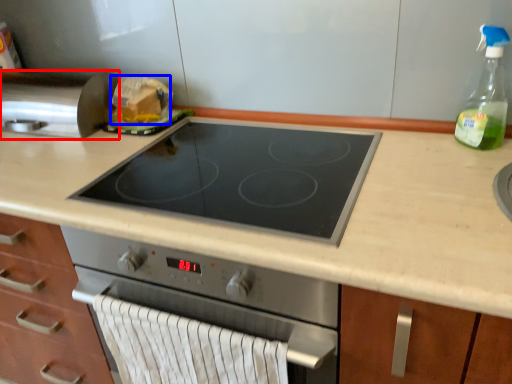
Question: Which of the following is the farthest to the observer, kitchen appliance (highlighted by a red box) or food (highlighted by a blue box)?

Choices:
 (A) kitchen appliance
 (B) food

Answer: (B)